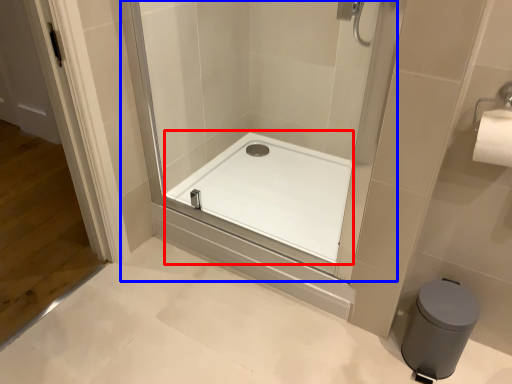
Question: Which object is further to the camera taking this photo, bath (highlighted by a red box) or shower door (highlighted by a blue box)?

Choices:
 (A) bath
 (B) shower door

Answer: (A)